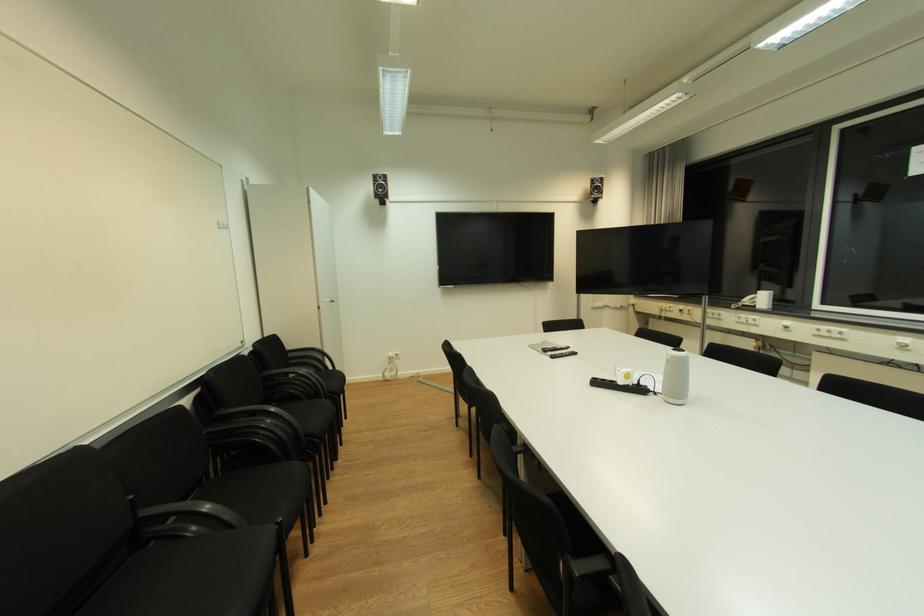
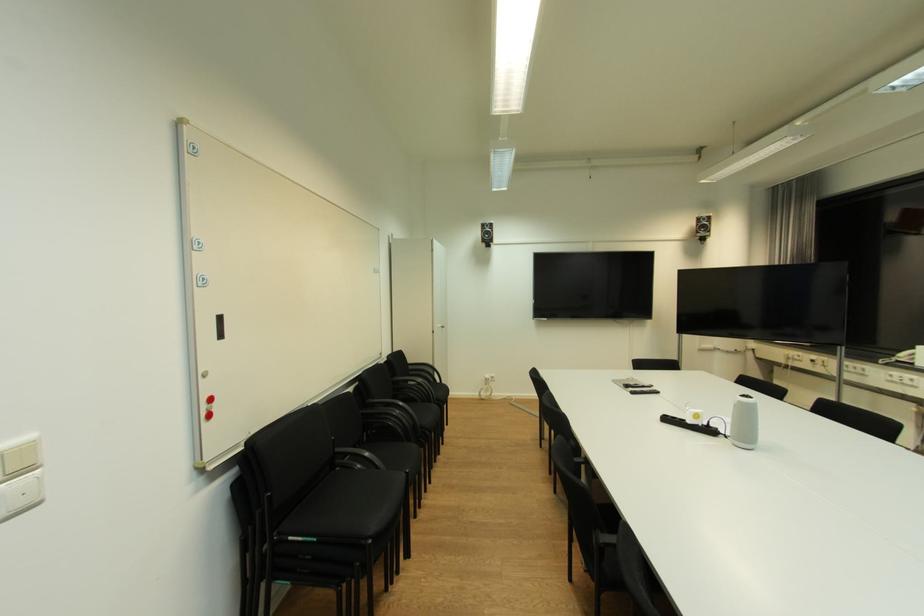
Question: Based on the continuous images, in which direction is the camera rotating? Reply with the corresponding letter.

Choices:
 (A) Left
 (B) Right
 (C) Up
 (D) Down

Answer: (A)